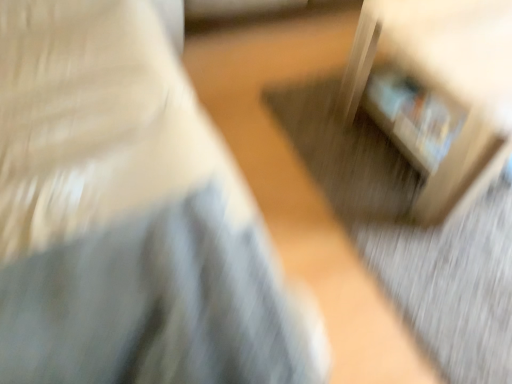
Question: Does point (45, 231) appear closer or farther from the camera than point (499, 43)?

Choices:
 (A) farther
 (B) closer

Answer: (B)

Question: Is matte white bookshelf at upper right, the 2th furniture from the right, wider or thinner than wooden crate at lower right, arranged as the second furniture when viewed from the left?

Choices:
 (A) wide
 (B) thin

Answer: (A)

Question: Relative to wooden crate at lower right, arranged as the second furniture when viewed from the left, is matte white bookshelf at upper right, which ranks as the 1th furniture in left-to-right order, in front or behind?

Choices:
 (A) behind
 (B) front

Answer: (B)

Question: In terms of width, does wooden crate at lower right, arranged as the second furniture when viewed from the left, look wider or thinner when compared to matte white bookshelf at upper right, which ranks as the 1th furniture in left-to-right order?

Choices:
 (A) wide
 (B) thin

Answer: (B)

Question: Is wooden crate at lower right, arranged as the second furniture when viewed from the left, in front of or behind matte white bookshelf at upper right, which ranks as the 1th furniture in left-to-right order, in the image?

Choices:
 (A) front
 (B) behind

Answer: (B)

Question: Would you say wooden crate at lower right, which is counted as the first furniture, starting from the right, is to the left or to the right of matte white bookshelf at upper right, the 2th furniture from the right, in the picture?

Choices:
 (A) left
 (B) right

Answer: (B)

Question: From their relative heights in the image, would you say wooden crate at lower right, which is counted as the first furniture, starting from the right, is taller or shorter than matte white bookshelf at upper right, which ranks as the 1th furniture in left-to-right order?

Choices:
 (A) tall
 (B) short

Answer: (B)